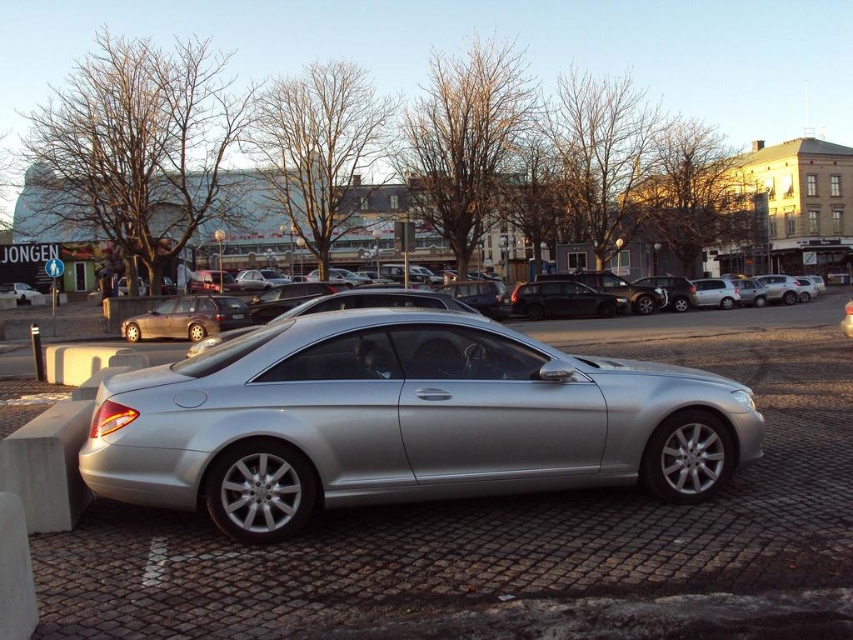
Consider the image. You are standing in front of a silver Mercedes CL Class coupe parked on a cobblestone street. There is a point marked at coordinates (184, 317). What object is located at that point?

The point at (184, 317) is occupied by a matte brown sedan at center.

You are a parking attendant and need to fit both the matte brown sedan at center and the matte black car at left into a parking spot that is 5 meters long. Given their lengths, which car should you park first to ensure both fit?

The matte brown sedan at center is shorter than the matte black car at left, so you should park the matte black car at left first, leaving enough space for the shorter matte brown sedan at center behind it.

You are a photographer trying to capture both the matte brown sedan at center and the shiny black sedan at center in a single shot. Which sedan should you focus on first to ensure both are in frame?

You should focus on the matte brown sedan at center first since it is closer to the viewer than the shiny black sedan at center, ensuring both are within the frame by adjusting the camera angle accordingly.